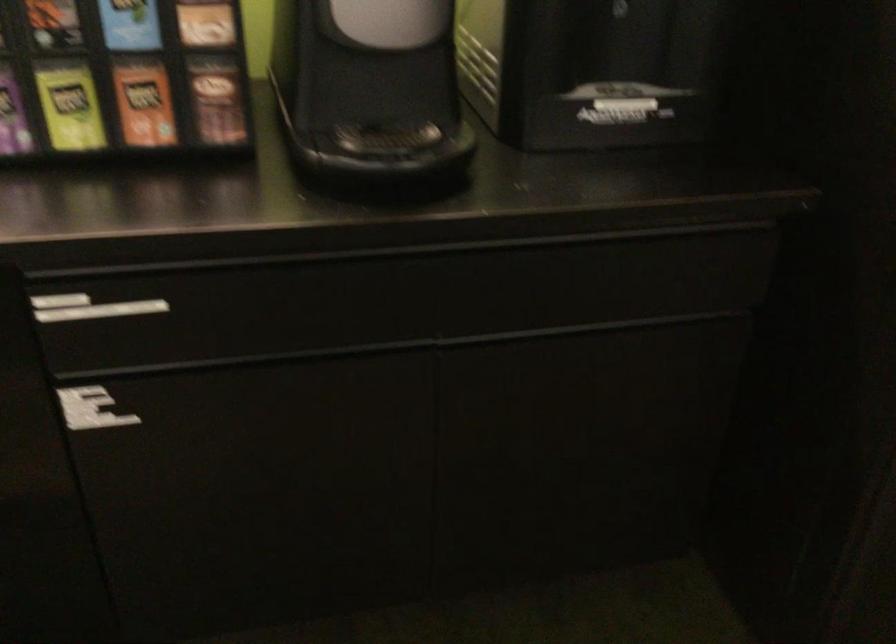
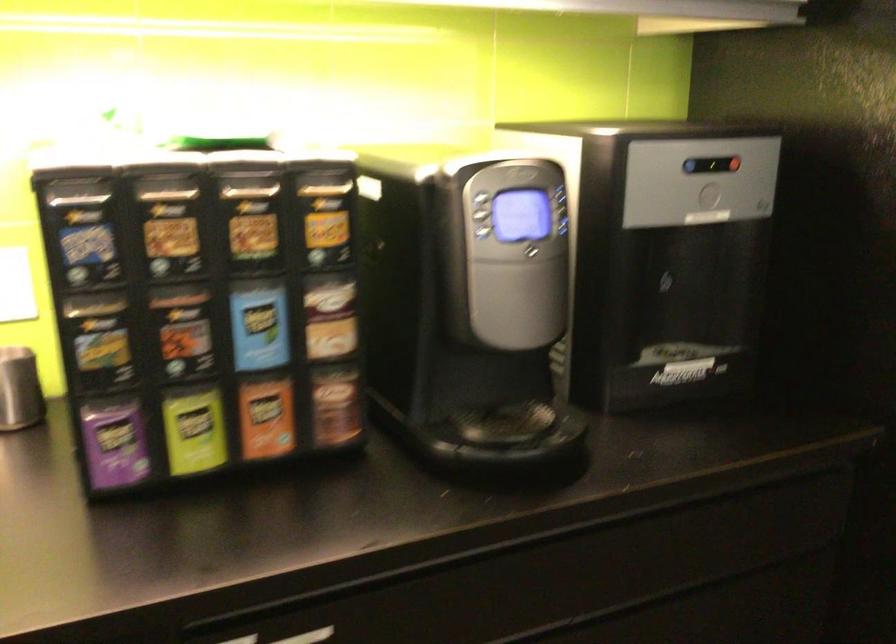
In the second image, find the point that corresponds to [222,104] in the first image.

(336, 406)